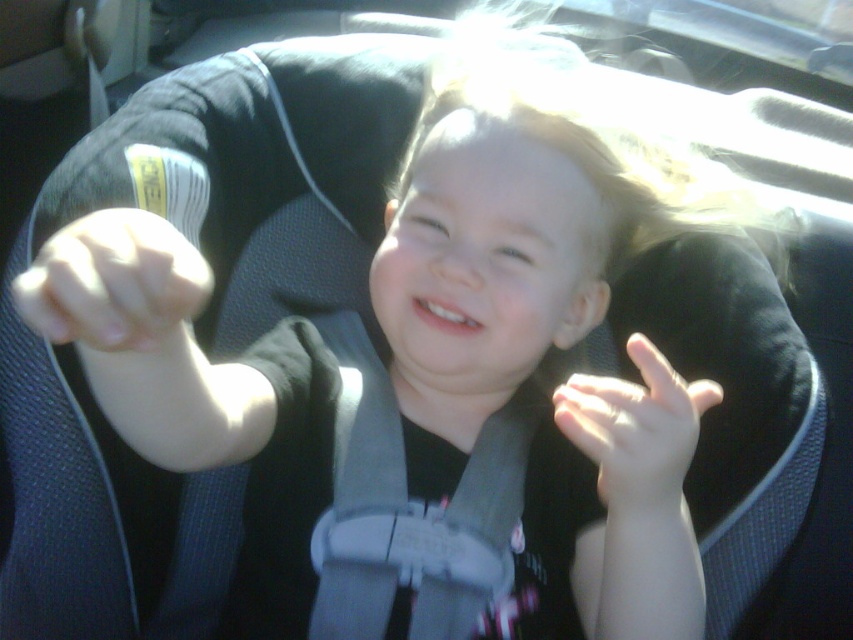
You are a safety inspector checking the car seat. You notice the gray fabric strap at center and the white matte hand at center. Which object is larger in size?

The gray fabric strap at center is bigger than the white matte hand at center.